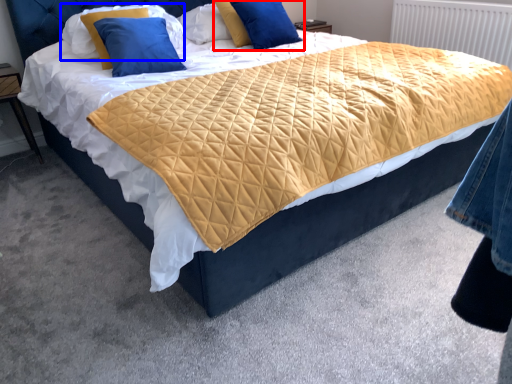
Question: Among these objects, which one is farthest to the camera, pillow (highlighted by a red box) or pillow (highlighted by a blue box)?

Choices:
 (A) pillow
 (B) pillow

Answer: (A)